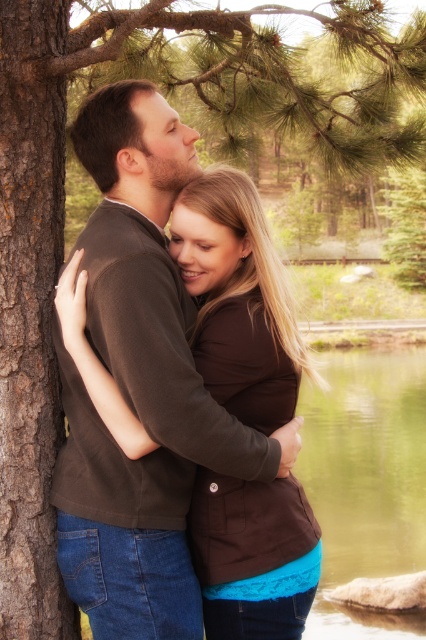
Can you confirm if brown matte sweater at center is positioned below green liquid water at lower center?

Actually, brown matte sweater at center is above green liquid water at lower center.

This screenshot has height=640, width=426. What do you see at coordinates (138, 384) in the screenshot?
I see `brown matte sweater at center` at bounding box center [138, 384].

The image size is (426, 640). I want to click on brown matte sweater at center, so pos(138,384).